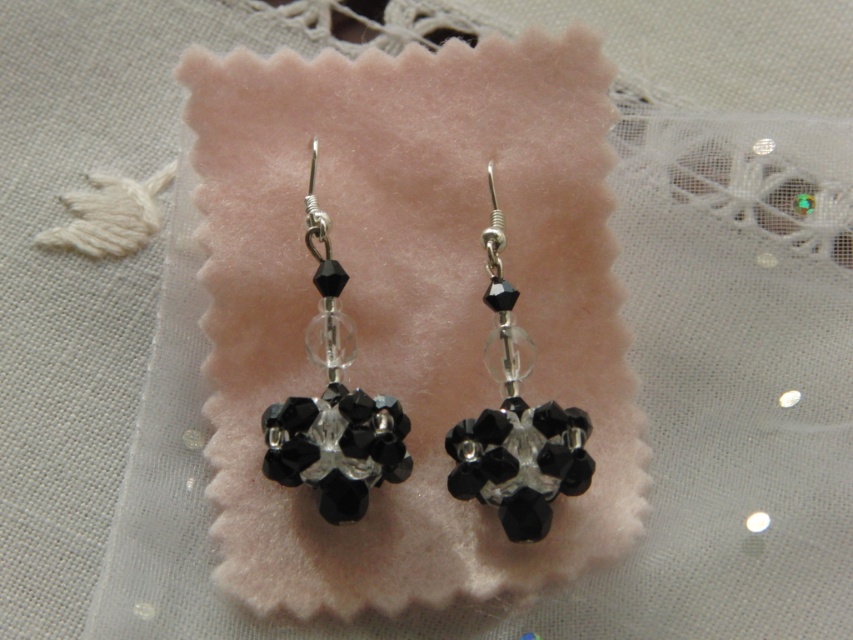
Is black crystal earrings at center smaller than black crystal cluster at center?

Indeed, black crystal earrings at center has a smaller size compared to black crystal cluster at center.

Which is behind, point (357, 513) or point (485, 445)?

The point (485, 445) is behind.

You are a GUI agent. You are given a task and a screenshot of the screen. Output one action in this format:
    pyautogui.click(x=<x>, y=<y>)
    Task: Click on the black crystal earrings at center
    The height and width of the screenshot is (640, 853).
    Given the screenshot: What is the action you would take?
    pyautogui.click(x=334, y=404)